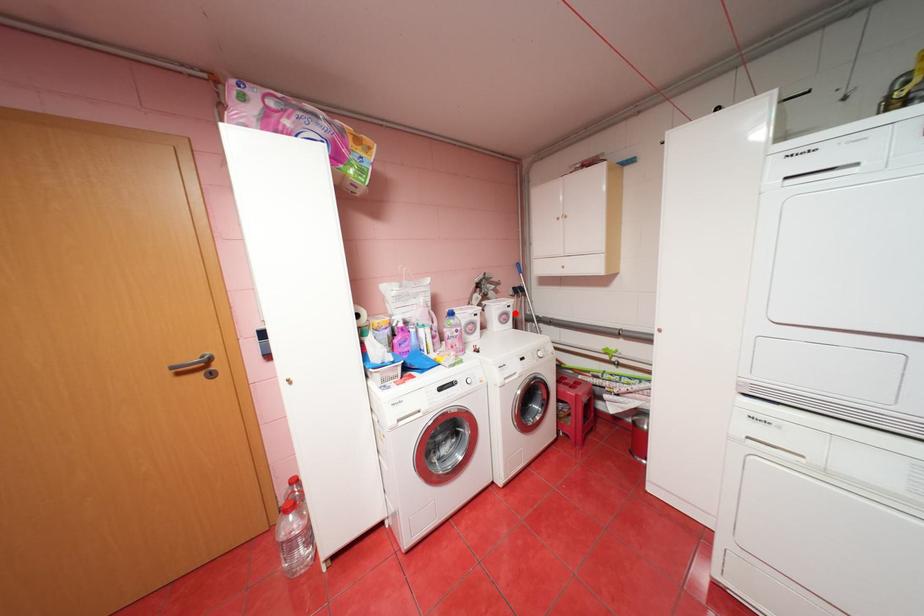
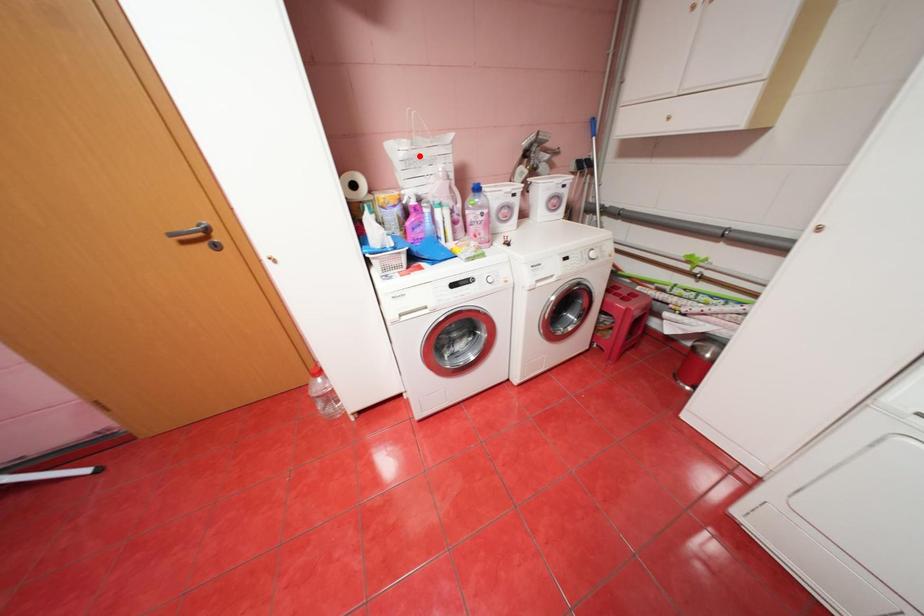
I am providing you with two images of the same scene from different viewpoints. A red point is marked on the first image and another point is marked on the second image. Does the point marked in image1 correspond to the same location as the one in image2?

No